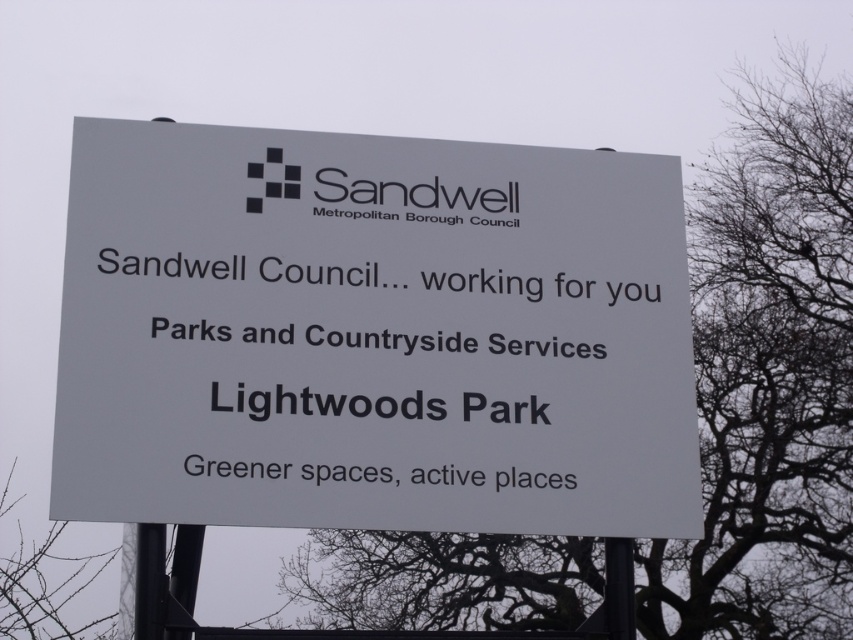
Question: Which of the following is the closest to the observer?

Choices:
 (A) bare branches at upper right
 (B) white plastic sign at center

Answer: (B)

Question: Does white plastic sign at center appear over bare branches at upper right?

Choices:
 (A) yes
 (B) no

Answer: (A)

Question: Which point is closer to the camera?

Choices:
 (A) (189, 451)
 (B) (732, 224)

Answer: (A)

Question: Is white plastic sign at center to the left of bare branches at upper right from the viewer's perspective?

Choices:
 (A) no
 (B) yes

Answer: (B)

Question: Does white plastic sign at center have a greater width compared to bare branches at upper right?

Choices:
 (A) no
 (B) yes

Answer: (A)